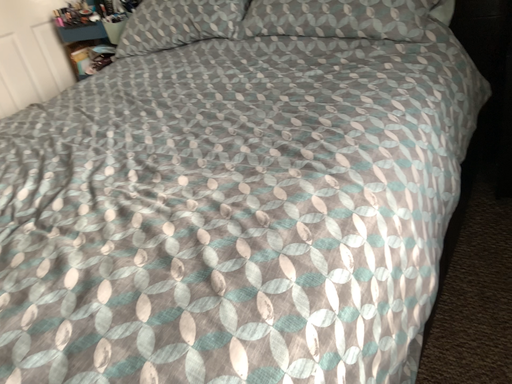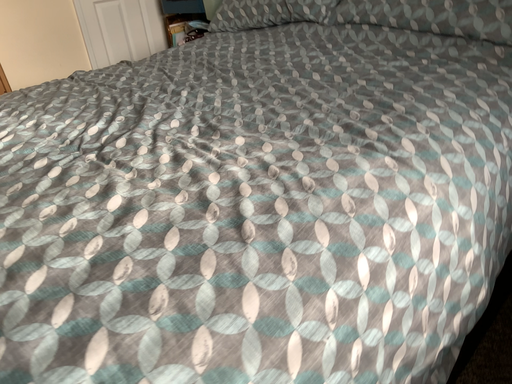
Question: How did the camera likely rotate when shooting the video?

Choices:
 (A) rotated right
 (B) rotated left

Answer: (B)